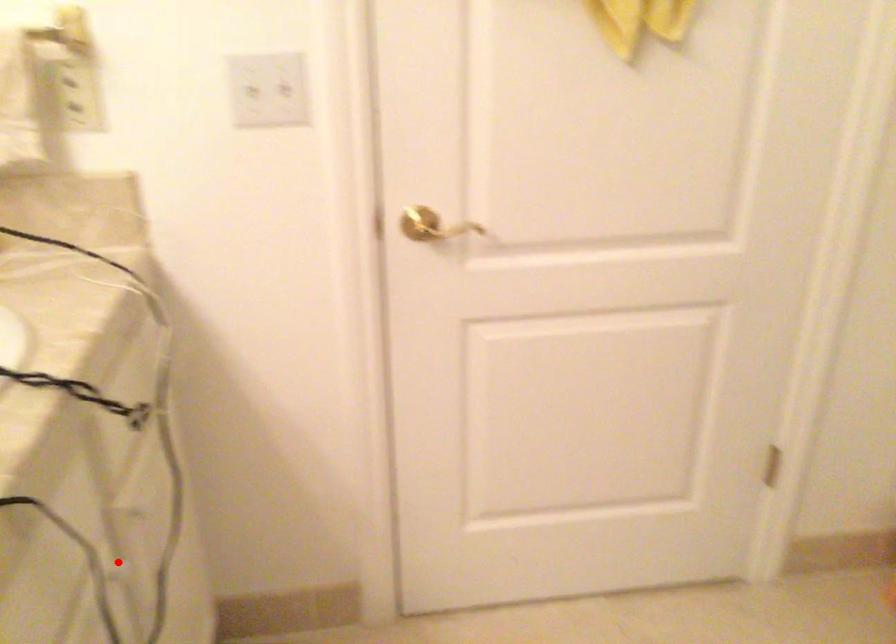
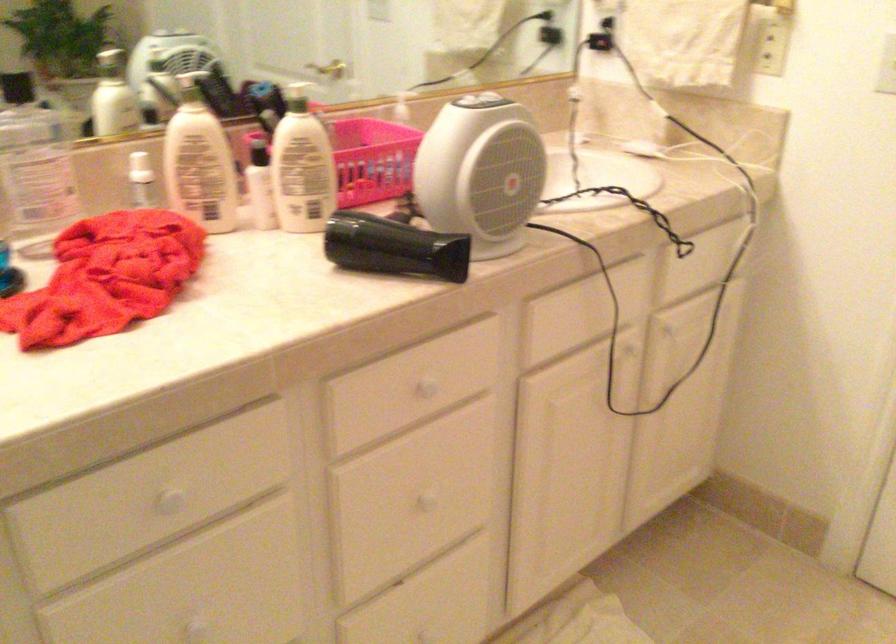
Where in the second image is the point corresponding to the highlighted location from the first image?

(625, 348)